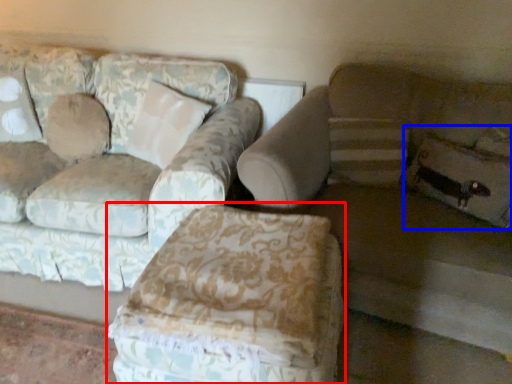
Question: Among these objects, which one is farthest to the camera, swivel chair (highlighted by a red box) or pillow (highlighted by a blue box)?

Choices:
 (A) swivel chair
 (B) pillow

Answer: (B)